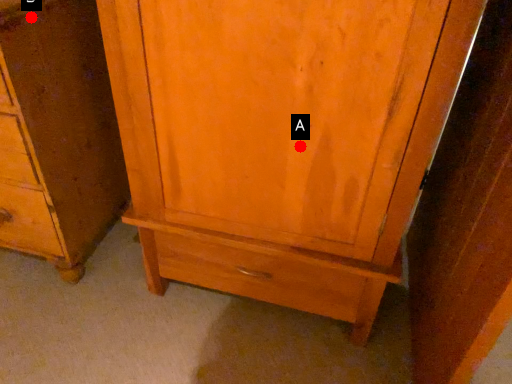
Question: Two points are circled on the image, labeled by A and B beside each circle. Which point is farther to the camera?

Choices:
 (A) A is further
 (B) B is further

Answer: (B)